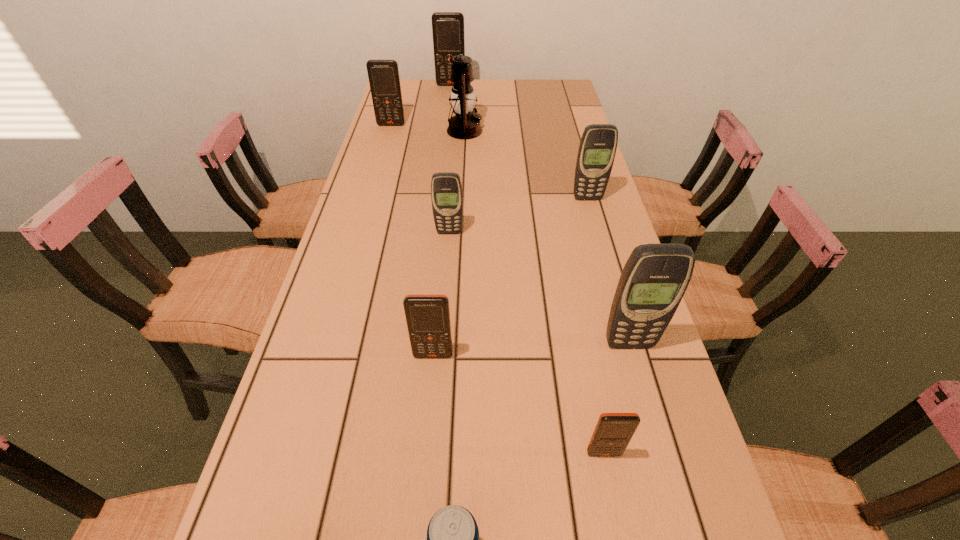
Identify the location of vacant space located 0.190m on the screen of the smallest gray cellular telephone. (445, 288).

At what (x,y) coordinates should I click in order to perform the action: click on free point located on the screen of the third nearest object. Please return your answer as a coordinate pair (x, y). This screenshot has height=540, width=960. Looking at the image, I should click on (420, 503).

Identify the location of free spot located 0.070m on the screen of the smallest orange cellular telephone. (613, 502).

Identify the location of object that is at the far edge. The width and height of the screenshot is (960, 540). (447, 27).

Where is `object that is at the left edge`? The width and height of the screenshot is (960, 540). object that is at the left edge is located at coordinates tap(383, 75).

The height and width of the screenshot is (540, 960). In the image, there is a desktop. Identify the location of vacant area at the far edge. (495, 92).

This screenshot has width=960, height=540. In the image, there is a desktop. Find the location of `free space at the left edge`. free space at the left edge is located at coordinates (338, 525).

At what (x,y) coordinates should I click in order to perform the action: click on vacant space at the right edge of the desktop. Please return your answer as a coordinate pair (x, y). The height and width of the screenshot is (540, 960). Looking at the image, I should click on (679, 518).

The width and height of the screenshot is (960, 540). What are the coordinates of `empty space that is in between the brown lantern and the nearest orange cellular telephone` in the screenshot? It's located at (535, 292).

The width and height of the screenshot is (960, 540). Find the location of `vacant point located between the smallest gray cellular telephone and the seventh object from left to right`. vacant point located between the smallest gray cellular telephone and the seventh object from left to right is located at coordinates (527, 343).